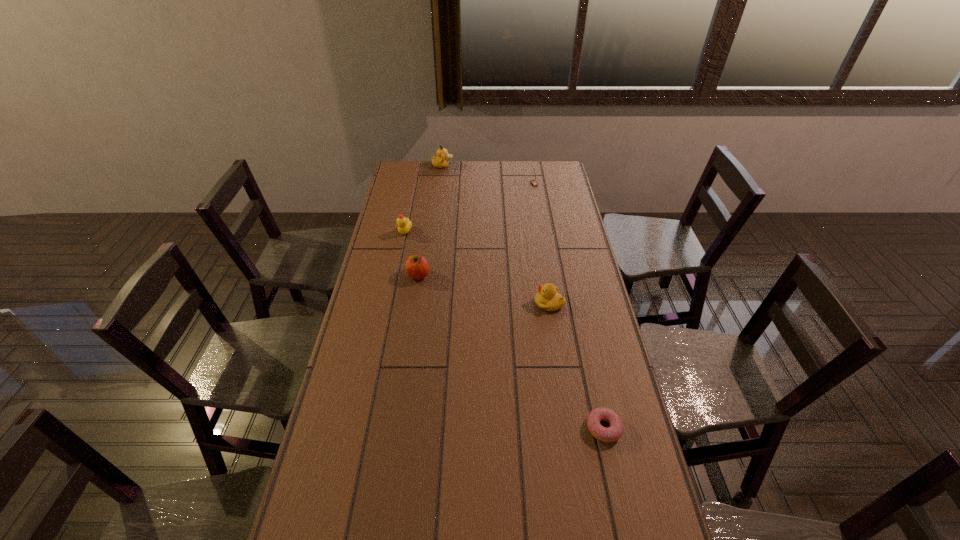
I want to click on the farthest object, so click(440, 161).

The image size is (960, 540). Identify the location of the second duckling from left to right. (440, 161).

Identify the location of the leftmost duckling. 404,225.

Locate an element on the screen. This screenshot has width=960, height=540. the second nearest duckling is located at coordinates (404, 225).

This screenshot has width=960, height=540. Identify the location of the third nearest object. (417, 267).

Image resolution: width=960 pixels, height=540 pixels. Find the location of `the fifth nearest object`. the fifth nearest object is located at coordinates (533, 182).

Find the location of a particular element. the nearest duckling is located at coordinates pos(548,299).

Find the location of `the rightmost duckling`. the rightmost duckling is located at coordinates (548, 299).

Locate an element on the screen. This screenshot has height=540, width=960. the shortest object is located at coordinates (614, 432).

Find the location of a particular element. The height and width of the screenshot is (540, 960). the nearest object is located at coordinates (614, 432).